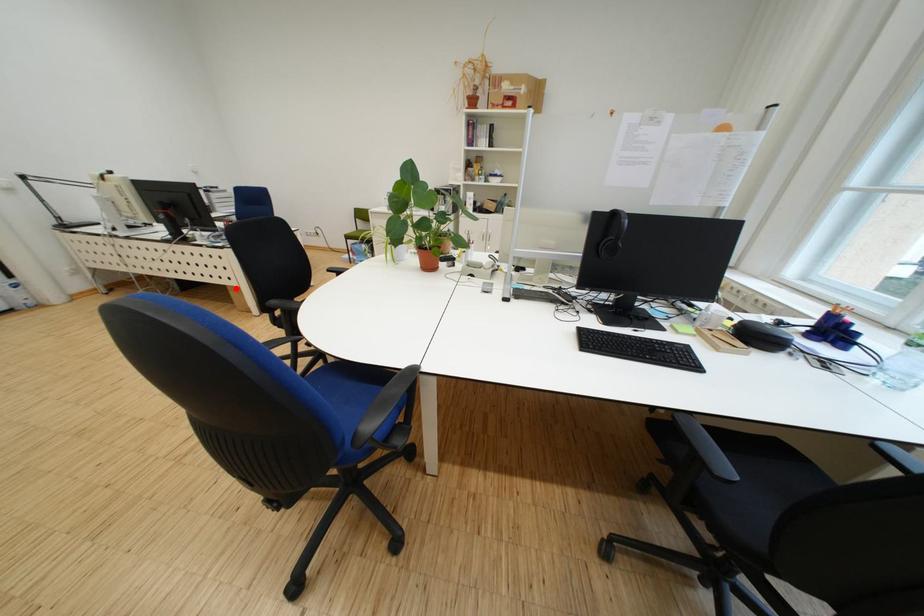
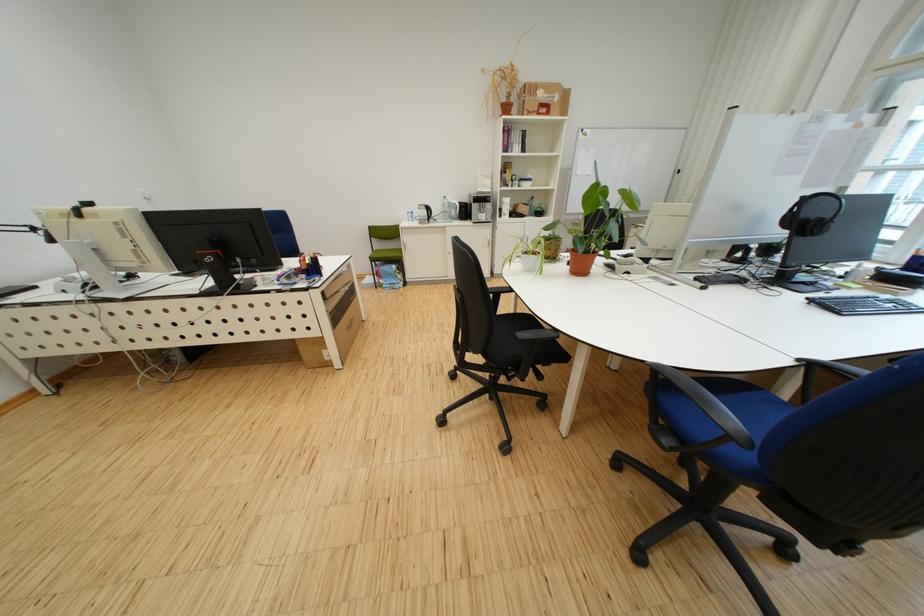
The point at the highlighted location is marked in the first image. Where is the corresponding point in the second image?

(306, 342)